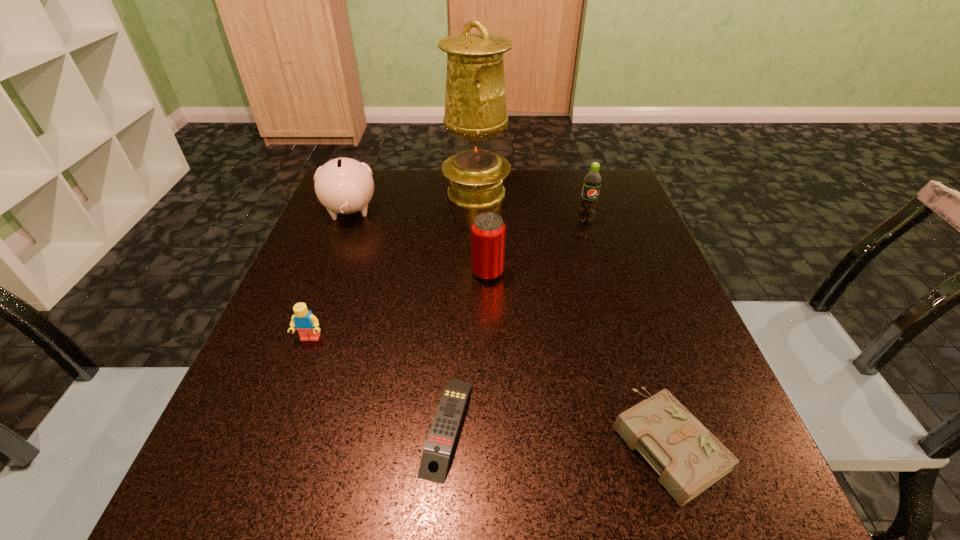
Locate an element on the screen. This screenshot has height=540, width=960. piggy bank at the left edge is located at coordinates (343, 185).

What are the coordinates of `Lego present at the left edge` in the screenshot? It's located at (306, 324).

At what (x,y) coordinates should I click in order to perform the action: click on soda positioned at the right edge. Please return your answer as a coordinate pair (x, y). The image size is (960, 540). Looking at the image, I should click on 592,181.

What are the coordinates of `diary present at the right edge` in the screenshot? It's located at (689, 459).

This screenshot has width=960, height=540. In order to click on object situated at the far left corner in this screenshot , I will do `click(343, 185)`.

You are a GUI agent. You are given a task and a screenshot of the screen. Output one action in this format:
    pyautogui.click(x=<x>, y=<y>)
    Task: Click on the object that is at the far right corner
    Image resolution: width=960 pixels, height=540 pixels.
    Given the screenshot: What is the action you would take?
    pyautogui.click(x=592, y=181)

The image size is (960, 540). I want to click on object positioned at the near right corner, so click(689, 459).

In the image, there is a desktop. Where is `vacant space at the far edge`? The image size is (960, 540). vacant space at the far edge is located at coordinates (552, 173).

Image resolution: width=960 pixels, height=540 pixels. I want to click on vacant space at the near edge of the desktop, so click(445, 529).

In the image, there is a desktop. Find the location of `vacant space at the left edge`. vacant space at the left edge is located at coordinates (333, 252).